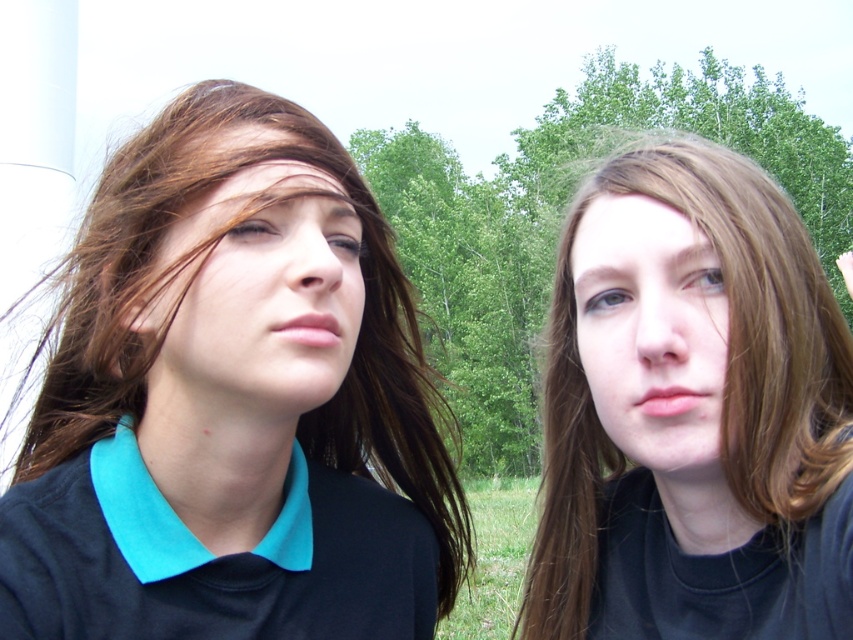
Between matte black shirt at left and smooth brown hair at upper right, which one appears on the left side from the viewer's perspective?

matte black shirt at left is more to the left.

Can you confirm if matte black shirt at left is positioned to the right of smooth brown hair at upper right?

No, matte black shirt at left is not to the right of smooth brown hair at upper right.

Who is more forward, (88,500) or (677,429)?

Point (677,429)

Locate an element on the screen. matte black shirt at left is located at coordinates (231, 403).

Which is more to the right, matte black shirt at left or smooth skin face at right?

From the viewer's perspective, smooth skin face at right appears more on the right side.

Where is `matte black shirt at left`? The image size is (853, 640). matte black shirt at left is located at coordinates (231, 403).

Who is positioned more to the right, smooth brown hair at upper right or teal fabric polo shirt at left?

From the viewer's perspective, smooth brown hair at upper right appears more on the right side.

The height and width of the screenshot is (640, 853). I want to click on smooth brown hair at upper right, so click(x=691, y=412).

At what (x,y) coordinates should I click in order to perform the action: click on smooth brown hair at upper right. Please return your answer as a coordinate pair (x, y). Looking at the image, I should click on (691, 412).